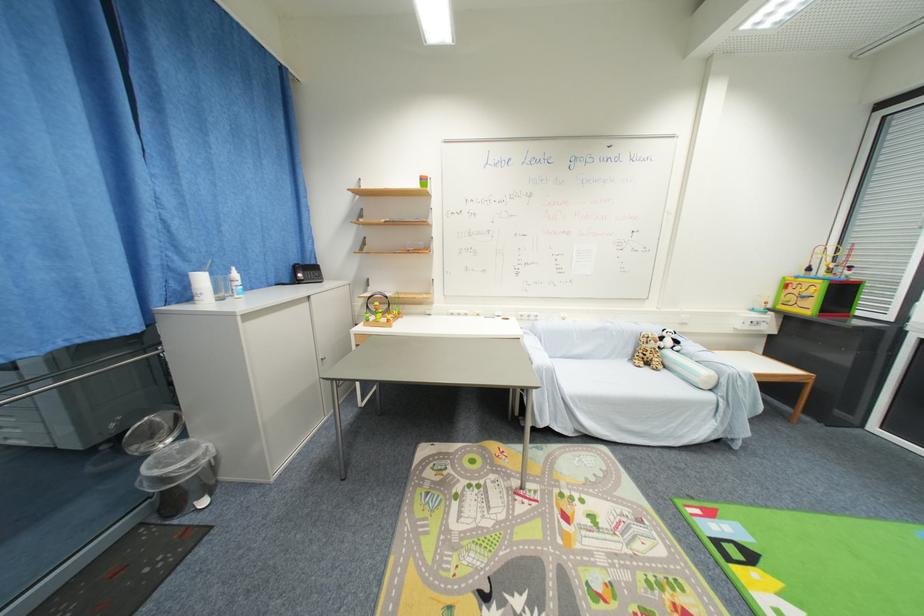
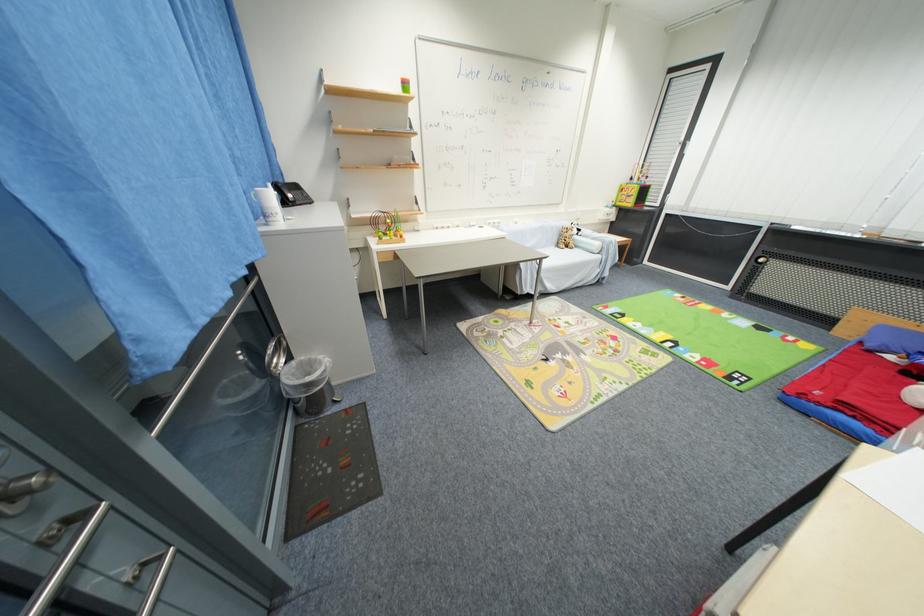
Where in the second image is the point corresponding to the point at 188,438 from the first image?

(295, 360)